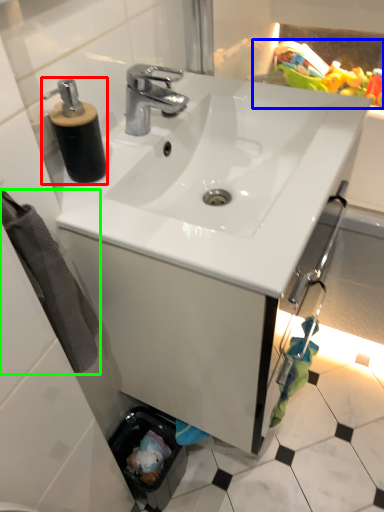
Question: Which object is the closest to the soap dispenser (highlighted by a red box)? Choose among these: toy (highlighted by a blue box) or bath towel (highlighted by a green box).

Choices:
 (A) toy
 (B) bath towel

Answer: (B)